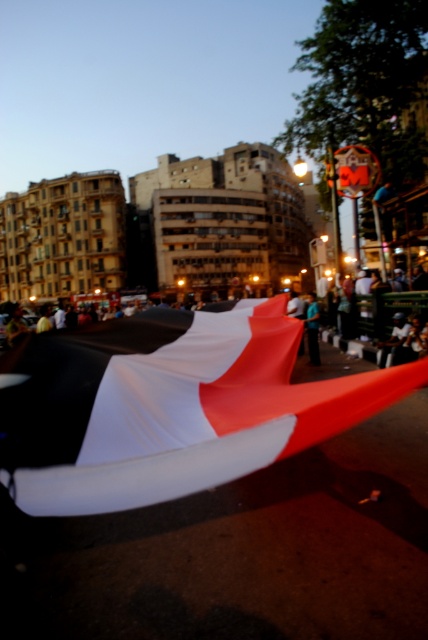
Question: Can you confirm if white matte flag at center is positioned to the right of blue fabric at center?

Choices:
 (A) yes
 (B) no

Answer: (B)

Question: Which point is farther to the camera?

Choices:
 (A) blue fabric at center
 (B) white matte flag at center

Answer: (A)

Question: Can you confirm if white matte flag at center is positioned below blue fabric at center?

Choices:
 (A) no
 (B) yes

Answer: (B)

Question: Among these objects, which one is farthest from the camera?

Choices:
 (A) white matte flag at center
 (B) blue fabric at center

Answer: (B)

Question: Is white matte flag at center smaller than blue fabric at center?

Choices:
 (A) yes
 (B) no

Answer: (A)